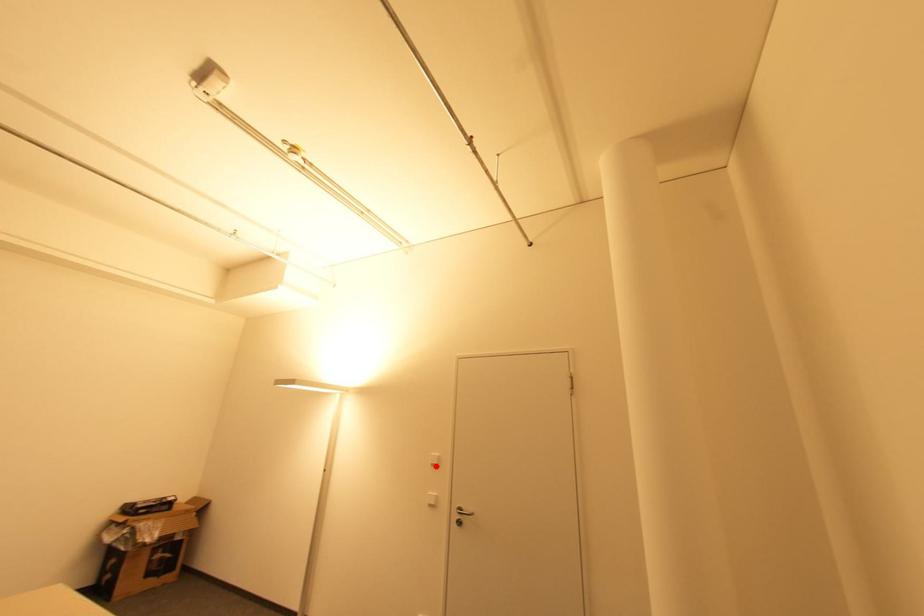
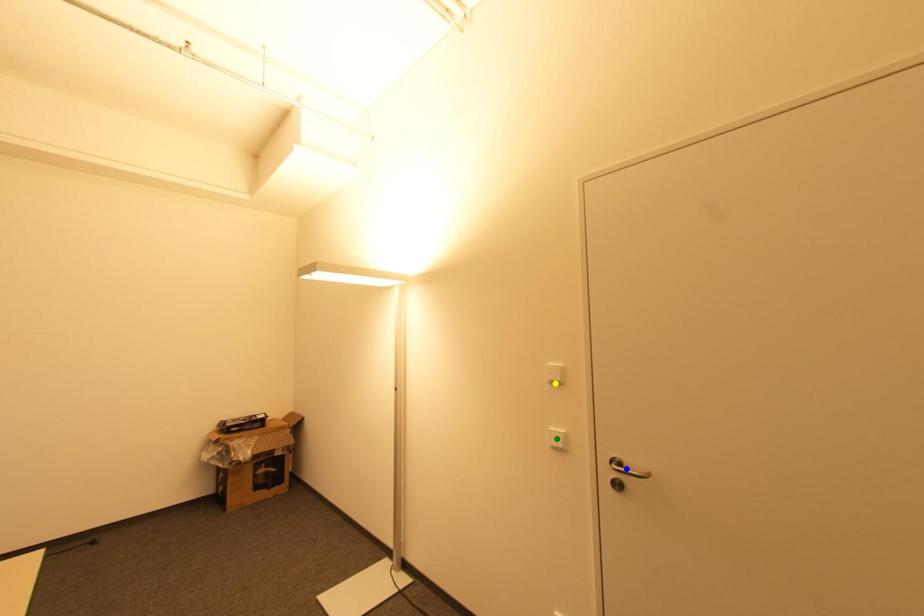
Question: I am providing you with two images of the same scene from different viewpoints. A red point is marked on the first image. You are given multiple points on the second image. Which mark in image 2 goes with the point in image 1?

Choices:
 (A) yellow point
 (B) blue point
 (C) green point

Answer: (A)